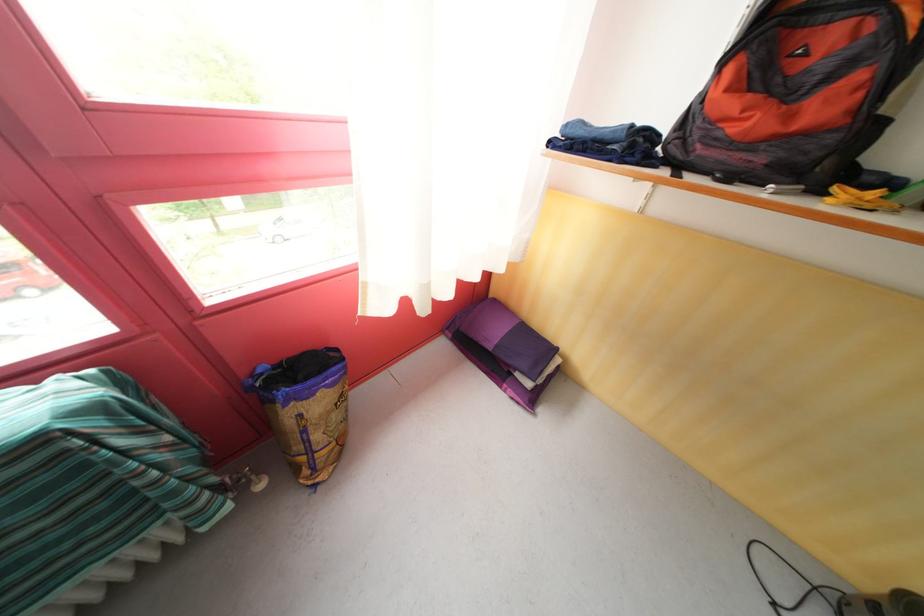
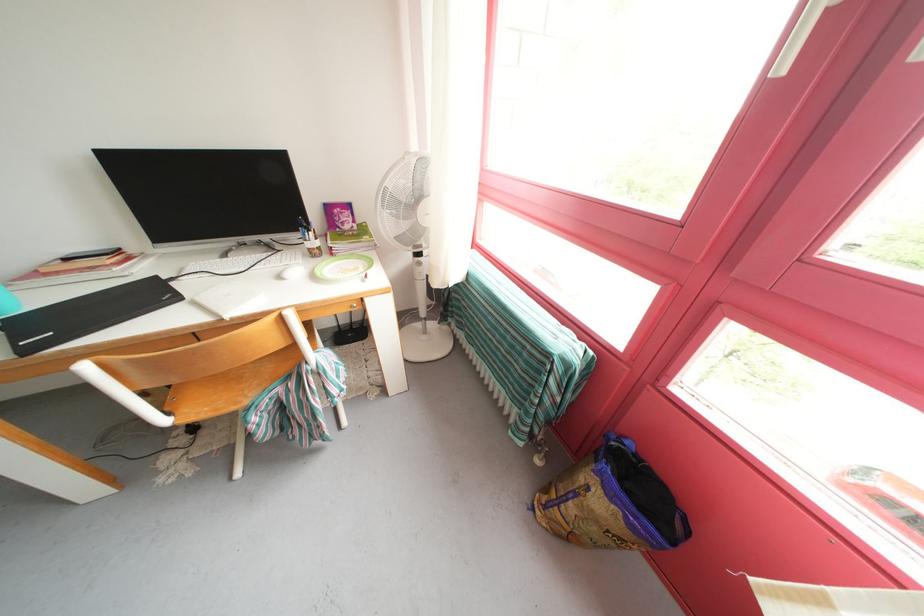
In the second image, find the point that corresponds to the point at 310,437 in the first image.

(582, 499)